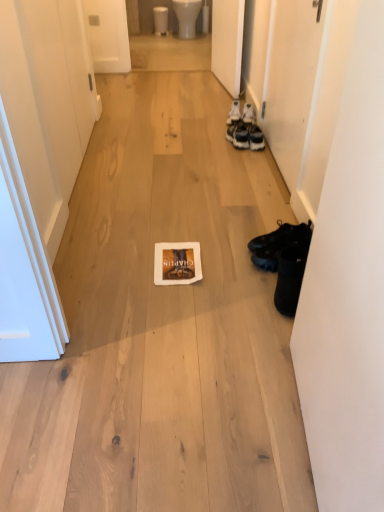
You are a GUI agent. You are given a task and a screenshot of the screen. Output one action in this format:
    pyautogui.click(x=<x>, y=<y>)
    Task: Click on the free space that is to the left of white matte door at upper right, marked as the 2th door in a left-to-right arrangement
    
    Given the screenshot: What is the action you would take?
    click(159, 80)